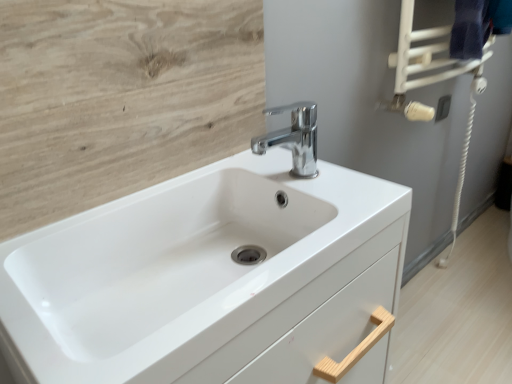
Question: Is the position of chrome metallic faucet at center less distant than that of white glossy sink at center?

Choices:
 (A) yes
 (B) no

Answer: (B)

Question: From the image's perspective, is chrome metallic faucet at center over white glossy sink at center?

Choices:
 (A) yes
 (B) no

Answer: (A)

Question: Is chrome metallic faucet at center completely or partially outside of white glossy sink at center?

Choices:
 (A) no
 (B) yes

Answer: (B)

Question: Is the depth of chrome metallic faucet at center greater than that of white glossy sink at center?

Choices:
 (A) no
 (B) yes

Answer: (B)

Question: From a real-world perspective, is chrome metallic faucet at center beneath white glossy sink at center?

Choices:
 (A) yes
 (B) no

Answer: (B)

Question: Considering the positions of point (92, 324) and point (397, 43), is point (92, 324) closer or farther from the camera than point (397, 43)?

Choices:
 (A) closer
 (B) farther

Answer: (A)

Question: Is white glossy sink at center spatially inside dark blue fabric towel bar at upper right, or outside of it?

Choices:
 (A) inside
 (B) outside

Answer: (B)

Question: Is white glossy sink at center wider or thinner than dark blue fabric towel bar at upper right?

Choices:
 (A) wide
 (B) thin

Answer: (A)

Question: Considering the positions of white glossy sink at center and dark blue fabric towel bar at upper right in the image, is white glossy sink at center bigger or smaller than dark blue fabric towel bar at upper right?

Choices:
 (A) small
 (B) big

Answer: (B)

Question: Considering the positions of chrome metallic faucet at center and light wood/texture at upper left in the image, is chrome metallic faucet at center wider or thinner than light wood/texture at upper left?

Choices:
 (A) thin
 (B) wide

Answer: (B)

Question: From the image's perspective, is chrome metallic faucet at center positioned above or below light wood/texture at upper left?

Choices:
 (A) above
 (B) below

Answer: (B)

Question: From a real-world perspective, relative to light wood/texture at upper left, is chrome metallic faucet at center vertically above or below?

Choices:
 (A) below
 (B) above

Answer: (A)

Question: Based on their positions, is chrome metallic faucet at center located to the left or right of light wood/texture at upper left?

Choices:
 (A) right
 (B) left

Answer: (A)

Question: From the image's perspective, is light wood/texture at upper left located above or below chrome metallic faucet at center?

Choices:
 (A) above
 (B) below

Answer: (A)

Question: In the image, is light wood/texture at upper left on the left side or the right side of chrome metallic faucet at center?

Choices:
 (A) right
 (B) left

Answer: (B)